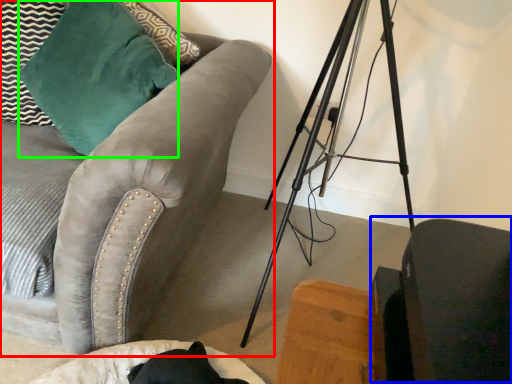
Question: Which is farther away from studio couch (highlighted by a red box)? swivel chair (highlighted by a blue box) or throw pillow (highlighted by a green box)?

Choices:
 (A) swivel chair
 (B) throw pillow

Answer: (A)